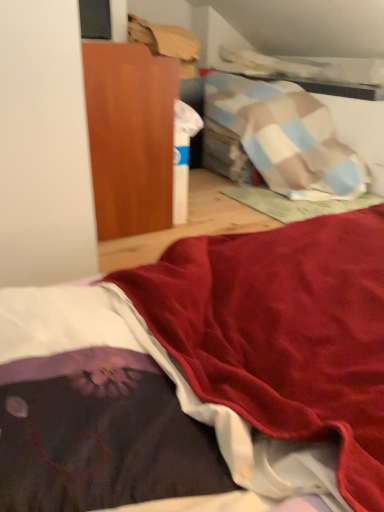
This screenshot has width=384, height=512. I want to click on free space above velvet dark purple blanket at lower left (from a real-world perspective), so click(x=89, y=347).